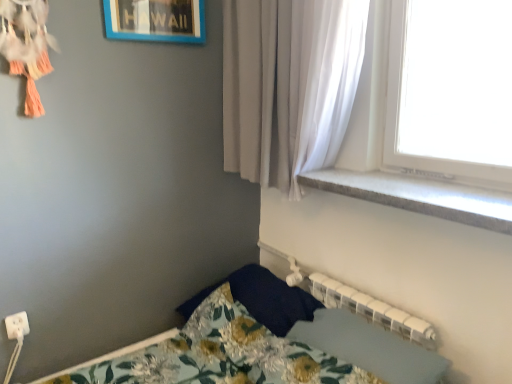
Question: From the image's perspective, is gray concrete window sill at upper right under floral fabric bedsheet at lower center?

Choices:
 (A) no
 (B) yes

Answer: (A)

Question: Is the surface of gray concrete window sill at upper right in direct contact with floral fabric bedsheet at lower center?

Choices:
 (A) yes
 (B) no

Answer: (B)

Question: Is gray concrete window sill at upper right in front of floral fabric bedsheet at lower center?

Choices:
 (A) no
 (B) yes

Answer: (B)

Question: Does gray concrete window sill at upper right have a smaller size compared to floral fabric bedsheet at lower center?

Choices:
 (A) yes
 (B) no

Answer: (A)

Question: Does gray concrete window sill at upper right have a greater width compared to floral fabric bedsheet at lower center?

Choices:
 (A) yes
 (B) no

Answer: (A)

Question: Considering the positions of floral fabric bedsheet at lower center and white sheer curtain at upper right in the image, is floral fabric bedsheet at lower center wider or thinner than white sheer curtain at upper right?

Choices:
 (A) wide
 (B) thin

Answer: (B)

Question: Considering the positions of floral fabric bedsheet at lower center and white sheer curtain at upper right in the image, is floral fabric bedsheet at lower center taller or shorter than white sheer curtain at upper right?

Choices:
 (A) short
 (B) tall

Answer: (A)

Question: Looking at the image, does floral fabric bedsheet at lower center seem bigger or smaller compared to white sheer curtain at upper right?

Choices:
 (A) small
 (B) big

Answer: (A)

Question: From a real-world perspective, is floral fabric bedsheet at lower center above or below white sheer curtain at upper right?

Choices:
 (A) below
 (B) above

Answer: (A)

Question: Would you say white sheer curtain at upper right is to the left or to the right of white plastic electric outlet at lower left in the picture?

Choices:
 (A) left
 (B) right

Answer: (B)

Question: Considering the positions of point (344, 18) and point (10, 332), is point (344, 18) closer or farther from the camera than point (10, 332)?

Choices:
 (A) farther
 (B) closer

Answer: (B)

Question: Looking at the image, does white sheer curtain at upper right seem bigger or smaller compared to white plastic electric outlet at lower left?

Choices:
 (A) small
 (B) big

Answer: (B)

Question: Do you think white sheer curtain at upper right is within white plastic electric outlet at lower left, or outside of it?

Choices:
 (A) outside
 (B) inside

Answer: (A)

Question: Is white plastic electric outlet at lower left to the left or to the right of blue plastic picture frame at upper center in the image?

Choices:
 (A) left
 (B) right

Answer: (A)

Question: From a real-world perspective, is white plastic electric outlet at lower left above or below blue plastic picture frame at upper center?

Choices:
 (A) above
 (B) below

Answer: (B)